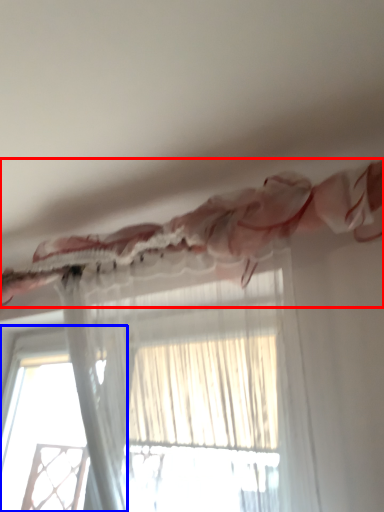
Question: Among these objects, which one is nearest to the camera, curtain (highlighted by a red box) or window (highlighted by a blue box)?

Choices:
 (A) curtain
 (B) window

Answer: (A)